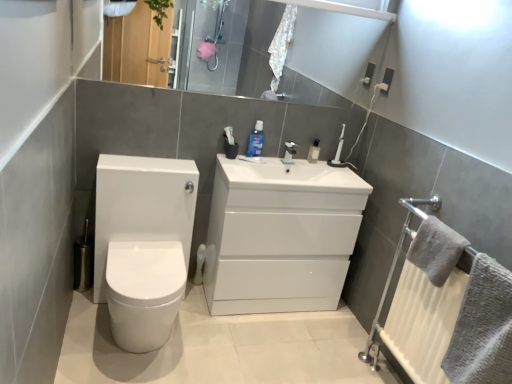
The width and height of the screenshot is (512, 384). I want to click on white glossy toilet at left, so click(143, 244).

In order to click on gray textured towel at right, acting as the first bath towel starting from the bottom in this screenshot , I will do (x=483, y=327).

What do you see at coordinates (483, 327) in the screenshot? The width and height of the screenshot is (512, 384). I see `gray textured towel at right, acting as the first bath towel starting from the bottom` at bounding box center [483, 327].

You are a GUI agent. You are given a task and a screenshot of the screen. Output one action in this format:
    pyautogui.click(x=<x>, y=<y>)
    Task: Click on the transparent plastic bottle at upper center, the 1th mouthwash when ordered from right to left
    
    Given the screenshot: What is the action you would take?
    pyautogui.click(x=314, y=152)

Measure the distance between glossy white mirror at upper center and camera.

The depth of glossy white mirror at upper center is 2.39 meters.

At what (x,y) coordinates should I click in order to perform the action: click on blue glossy mouthwash at center, marked as the 1th mouthwash in a left-to-right arrangement. Please return your answer as a coordinate pair (x, y). The width and height of the screenshot is (512, 384). Looking at the image, I should click on (256, 140).

Is glossy white mirror at upper center facing away from white glossy cabinet at center?

No, glossy white mirror at upper center is not facing the opposite direction of white glossy cabinet at center.

Is point (297, 54) less distant than point (231, 198)?

No, (297, 54) is behind (231, 198).

From the image's perspective, is glossy white mirror at upper center above or below white glossy cabinet at center?

From the image's perspective, glossy white mirror at upper center appears above white glossy cabinet at center.

From the image's perspective, is transparent plastic bottle at upper center, marked as the 2th mouthwash in a left-to-right arrangement, beneath gray textured towel at right, acting as the 2th bath towel starting from the top?

No, from the image's perspective, transparent plastic bottle at upper center, marked as the 2th mouthwash in a left-to-right arrangement, is not beneath gray textured towel at right, acting as the 2th bath towel starting from the top.

Does point (313, 155) appear closer or farther from the camera than point (506, 380)?

Point (313, 155) appears to be farther away from the viewer than point (506, 380).

Can you confirm if transparent plastic bottle at upper center, marked as the 2th mouthwash in a left-to-right arrangement, is shorter than gray textured towel at right, acting as the 2th bath towel starting from the top?

Indeed, transparent plastic bottle at upper center, marked as the 2th mouthwash in a left-to-right arrangement, has a lesser height compared to gray textured towel at right, acting as the 2th bath towel starting from the top.

From a real-world perspective, is gray textured towel at right, acting as the first bath towel starting from the bottom, physically above blue glossy mouthwash at center, marked as the 1th mouthwash in a left-to-right arrangement?

No, from a real-world perspective, gray textured towel at right, acting as the first bath towel starting from the bottom, is not on top of blue glossy mouthwash at center, marked as the 1th mouthwash in a left-to-right arrangement.

Considering the positions of point (475, 328) and point (248, 156), is point (475, 328) closer or farther from the camera than point (248, 156)?

Point (475, 328) is closer to the camera than point (248, 156).

Could you tell me if gray textured towel at right, acting as the first bath towel starting from the bottom, is facing blue glossy mouthwash at center, marked as the 1th mouthwash in a left-to-right arrangement?

No, gray textured towel at right, acting as the first bath towel starting from the bottom, is not facing towards blue glossy mouthwash at center, marked as the 1th mouthwash in a left-to-right arrangement.

Consider the image. Can you confirm if gray textured towel at right, acting as the first bath towel starting from the bottom, is shorter than blue glossy mouthwash at center, which is counted as the second mouthwash, starting from the right?

No, gray textured towel at right, acting as the first bath towel starting from the bottom, is not shorter than blue glossy mouthwash at center, which is counted as the second mouthwash, starting from the right.

From a real-world perspective, starting from the matte silver faucet at upper center, which mouthwash is the 2nd one vertically above it? Please provide its 2D coordinates.

[(256, 140)]

Is matte silver faucet at upper center oriented away from blue glossy mouthwash at center, which is counted as the second mouthwash, starting from the right?

matte silver faucet at upper center is not turned away from blue glossy mouthwash at center, which is counted as the second mouthwash, starting from the right.

From a real-world perspective, between matte silver faucet at upper center and blue glossy mouthwash at center, which is counted as the second mouthwash, starting from the right, who is vertically lower?

matte silver faucet at upper center, from a real-world perspective.

From a real-world perspective, is white glossy cabinet at center physically below glossy white mirror at upper center?

Correct, in the physical world, white glossy cabinet at center is lower than glossy white mirror at upper center.

Where is `bathroom cabinet located behind the glossy white mirror at upper center`? Image resolution: width=512 pixels, height=384 pixels. bathroom cabinet located behind the glossy white mirror at upper center is located at coordinates pyautogui.click(x=280, y=235).

Between white glossy cabinet at center and glossy white mirror at upper center, which one has larger size?

white glossy cabinet at center is bigger.

Is transparent plastic bottle at upper center, the 1th mouthwash when ordered from right to left, not close to white glossy cabinet at center?

transparent plastic bottle at upper center, the 1th mouthwash when ordered from right to left, is near white glossy cabinet at center, not far away.

This screenshot has height=384, width=512. Identify the location of mouthwash on the right of the white glossy cabinet at center. (314, 152).

From the image's perspective, does transparent plastic bottle at upper center, the 1th mouthwash when ordered from right to left, appear lower than white glossy cabinet at center?

No.

Considering their positions, is transparent plastic bottle at upper center, marked as the 2th mouthwash in a left-to-right arrangement, located in front of or behind white glossy cabinet at center?

Visually, transparent plastic bottle at upper center, marked as the 2th mouthwash in a left-to-right arrangement, is located behind white glossy cabinet at center.

Considering the relative sizes of glossy white mirror at upper center and gray fluffy towel at right, the 1th bath towel positioned from the top, in the image provided, is glossy white mirror at upper center thinner than gray fluffy towel at right, the 1th bath towel positioned from the top,?

Yes, glossy white mirror at upper center is thinner than gray fluffy towel at right, the 1th bath towel positioned from the top.

Is glossy white mirror at upper center next to gray fluffy towel at right, placed as the second bath towel when sorted from bottom to top?

No, glossy white mirror at upper center is not touching gray fluffy towel at right, placed as the second bath towel when sorted from bottom to top.

Is point (288, 61) farther from viewer compared to point (441, 238)?

Yes, point (288, 61) is behind point (441, 238).

In order to click on mirror above the white glossy cabinet at center (from the image's perspective) in this screenshot , I will do `click(327, 56)`.

From the gray textured towel at right, acting as the 2th bath towel starting from the top, count 2nd mouthwashs backward and point to it. Please provide its 2D coordinates.

[(314, 152)]

Which object lies nearer to the anchor point matte silver faucet at upper center, gray textured towel at right, acting as the 2th bath towel starting from the top, or white glossy toilet at left?

Based on the image, white glossy toilet at left appears to be nearer to matte silver faucet at upper center.

When comparing their distances from gray textured towel at right, acting as the 2th bath towel starting from the top, does blue glossy mouthwash at center, marked as the 1th mouthwash in a left-to-right arrangement, or matte silver faucet at upper center seem closer?

Based on the image, matte silver faucet at upper center appears to be nearer to gray textured towel at right, acting as the 2th bath towel starting from the top.

When comparing their distances from blue glossy mouthwash at center, which is counted as the second mouthwash, starting from the right, does matte silver faucet at upper center or transparent plastic bottle at upper center, the 1th mouthwash when ordered from right to left, seem closer?

Among the two, matte silver faucet at upper center is located nearer to blue glossy mouthwash at center, which is counted as the second mouthwash, starting from the right.

Which object lies nearer to the anchor point gray fluffy towel at right, the 1th bath towel positioned from the top, white glossy cabinet at center or white glossy toilet at left?

white glossy cabinet at center.

Looking at the image, which one is located further to white glossy toilet at left, glossy white mirror at upper center or transparent plastic bottle at upper center, marked as the 2th mouthwash in a left-to-right arrangement?

The object further to white glossy toilet at left is glossy white mirror at upper center.

Estimate the real-world distances between objects in this image. Which object is further from white glossy cabinet at center, white glossy toilet at left or matte silver faucet at upper center?

Based on the image, matte silver faucet at upper center appears to be further to white glossy cabinet at center.

Based on their spatial positions, is blue glossy mouthwash at center, which is counted as the second mouthwash, starting from the right, or white glossy cabinet at center further from matte silver faucet at upper center?

Based on the image, white glossy cabinet at center appears to be further to matte silver faucet at upper center.

Looking at the image, which one is located further to white glossy toilet at left, transparent plastic bottle at upper center, the 1th mouthwash when ordered from right to left, or matte silver faucet at upper center?

transparent plastic bottle at upper center, the 1th mouthwash when ordered from right to left, is further to white glossy toilet at left.

You are a GUI agent. You are given a task and a screenshot of the screen. Output one action in this format:
    pyautogui.click(x=<x>, y=<y>)
    Task: Click on the bathroom cabinet between gray textured towel at right, acting as the 2th bath towel starting from the top, and transparent plastic bottle at upper center, the 1th mouthwash when ordered from right to left, in the front-back direction
    This screenshot has height=384, width=512.
    Given the screenshot: What is the action you would take?
    pyautogui.click(x=280, y=235)

In order to click on bathroom cabinet located between white glossy toilet at left and gray textured towel at right, acting as the 2th bath towel starting from the top, in the left-right direction in this screenshot , I will do `click(280, 235)`.

At what (x,y) coordinates should I click in order to perform the action: click on tap between gray fluffy towel at right, the 1th bath towel positioned from the top, and transparent plastic bottle at upper center, marked as the 2th mouthwash in a left-to-right arrangement, along the z-axis. Please return your answer as a coordinate pair (x, y). Looking at the image, I should click on pos(289,152).

Where is `mouthwash positioned between white glossy toilet at left and matte silver faucet at upper center from near to far`? The height and width of the screenshot is (384, 512). mouthwash positioned between white glossy toilet at left and matte silver faucet at upper center from near to far is located at coordinates (256, 140).